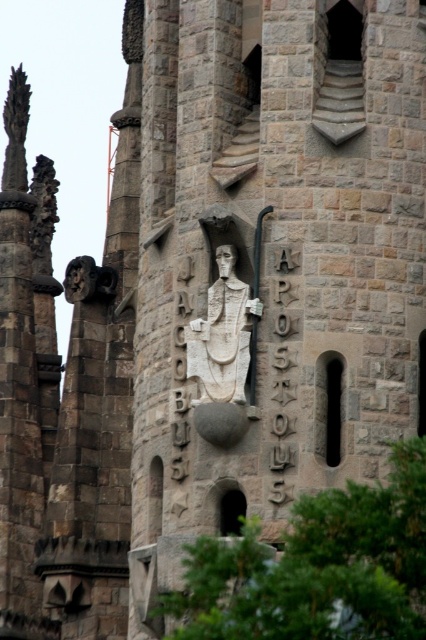
Question: Which of the following is the farthest from the observer?

Choices:
 (A) (207, 323)
 (B) (216, 250)
 (C) (92, 292)

Answer: (C)

Question: Which object appears closest to the camera in this image?

Choices:
 (A) matte stone face at upper left
 (B) white stone face at center

Answer: (B)

Question: Where is white stone statue at center located in relation to matte stone face at upper left in the image?

Choices:
 (A) right
 (B) left

Answer: (A)

Question: Can you confirm if white stone statue at center is positioned above matte stone face at upper left?

Choices:
 (A) yes
 (B) no

Answer: (B)

Question: Is matte stone face at upper left below white stone face at center?

Choices:
 (A) no
 (B) yes

Answer: (A)

Question: Which point is closer to the camera taking this photo?

Choices:
 (A) (66, 292)
 (B) (201, 384)
 (C) (218, 257)

Answer: (B)